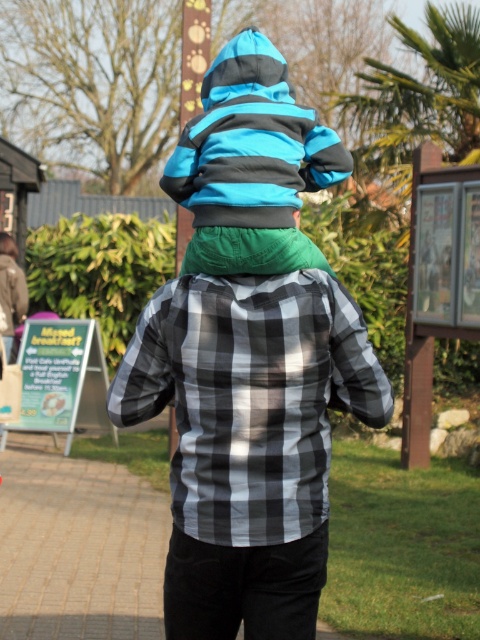
Question: Is black checkered shirt at center wider than blue striped jacket at center?

Choices:
 (A) no
 (B) yes

Answer: (B)

Question: Based on their relative distances, which object is nearer to the blue striped jacket at center?

Choices:
 (A) black checkered shirt at center
 (B) checkered fabric shirt at center

Answer: (B)

Question: Among these points, which one is farthest from the camera?

Choices:
 (A) (223, 164)
 (B) (267, 355)

Answer: (A)

Question: Is black checkered shirt at center below blue striped jacket at center?

Choices:
 (A) no
 (B) yes

Answer: (B)

Question: Estimate the real-world distances between objects in this image. Which object is closer to the blue striped jacket at center?

Choices:
 (A) black checkered shirt at center
 (B) checkered fabric shirt at center

Answer: (B)

Question: Can you confirm if checkered fabric shirt at center is positioned to the right of blue striped jacket at center?

Choices:
 (A) yes
 (B) no

Answer: (B)